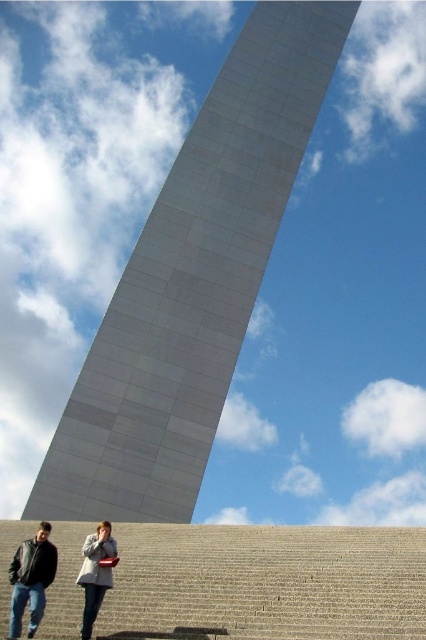
Question: Which object is the farthest from the light gray wool coat at lower center?

Choices:
 (A) matte black jacket at lower left
 (B) gray concrete stairs at lower center

Answer: (B)

Question: Which point is farther from the camera taking this photo?

Choices:
 (A) (89, 577)
 (B) (22, 547)

Answer: (B)

Question: Does white smooth arch at center come behind matte black jacket at lower left?

Choices:
 (A) yes
 (B) no

Answer: (A)

Question: Can you confirm if white smooth arch at center is positioned to the left of light gray wool coat at lower center?

Choices:
 (A) yes
 (B) no

Answer: (B)

Question: Is matte black jacket at lower left closer to the viewer compared to black leather jacket at lower left?

Choices:
 (A) no
 (B) yes

Answer: (A)

Question: Which is nearer to the black leather jacket at lower left?

Choices:
 (A) gray concrete stairs at lower center
 (B) light gray wool coat at lower center
 (C) white smooth arch at center
 (D) matte black jacket at lower left

Answer: (D)